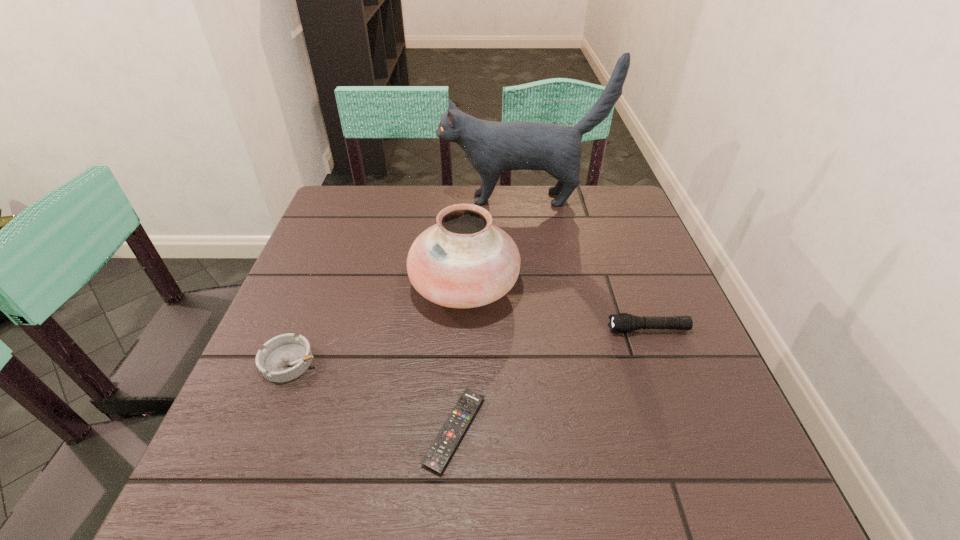
Locate an element on the screen. The height and width of the screenshot is (540, 960). unoccupied position between the fourth shortest object and the fourth farthest object is located at coordinates click(377, 324).

Where is `the second closest object to the pottery`? The width and height of the screenshot is (960, 540). the second closest object to the pottery is located at coordinates (285, 357).

The height and width of the screenshot is (540, 960). Identify the location of object that ranks as the fourth closest to the second tallest object. (492, 147).